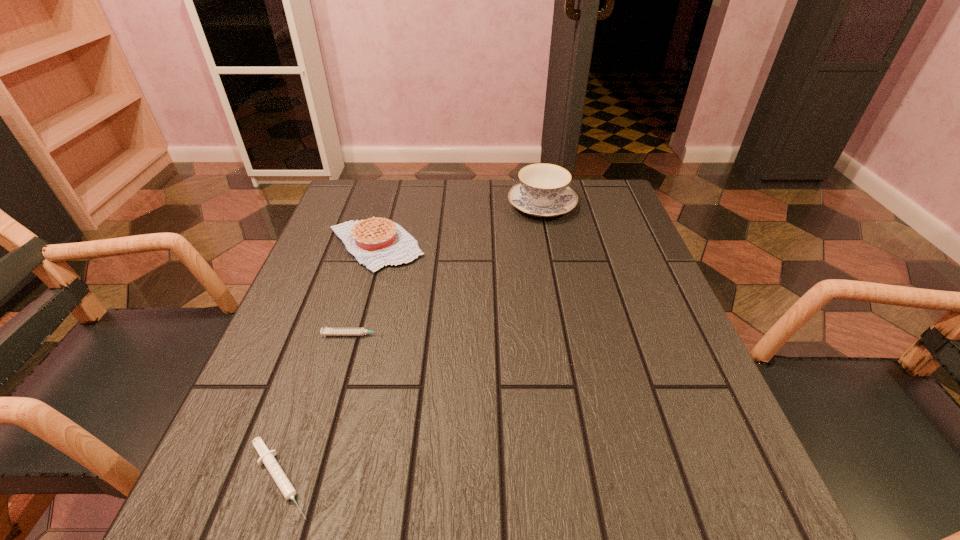
You are a GUI agent. You are given a task and a screenshot of the screen. Output one action in this format:
    pyautogui.click(x=<x>, y=<y>)
    Task: Click on the tallest object
    The height and width of the screenshot is (540, 960).
    Given the screenshot: What is the action you would take?
    pyautogui.click(x=543, y=191)

This screenshot has height=540, width=960. I want to click on chinaware, so click(543, 191).

The height and width of the screenshot is (540, 960). Find the location of `pie`. pie is located at coordinates (375, 242).

The height and width of the screenshot is (540, 960). Identify the location of the third farthest object. (325, 331).

Find the location of a particular element. the nearer syringe is located at coordinates (267, 458).

Locate an element on the screen. This screenshot has width=960, height=540. free space located 0.130m on the front of the third shortest object is located at coordinates (354, 317).

The height and width of the screenshot is (540, 960). Identify the location of vacant position located 0.190m at the needle end of the second nearest object. (484, 335).

Image resolution: width=960 pixels, height=540 pixels. Identify the location of vacant region located 0.140m on the right of the nearer syringe. (416, 478).

You are a GUI agent. You are given a task and a screenshot of the screen. Output one action in this format:
    pyautogui.click(x=<x>, y=<y>)
    Task: Click on the chinaware at the far edge
    This screenshot has width=960, height=540.
    Given the screenshot: What is the action you would take?
    pyautogui.click(x=543, y=191)

Find the location of a particular element. The width and height of the screenshot is (960, 540). pie located in the far edge section of the desktop is located at coordinates (375, 242).